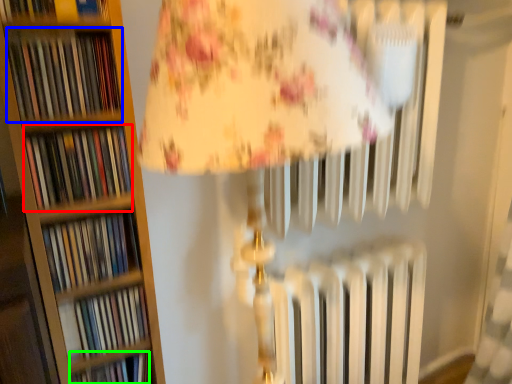
Question: Which object is the farthest from book (highlighted by a red box)? Choose among these: book (highlighted by a blue box) or book (highlighted by a green box).

Choices:
 (A) book
 (B) book

Answer: (B)